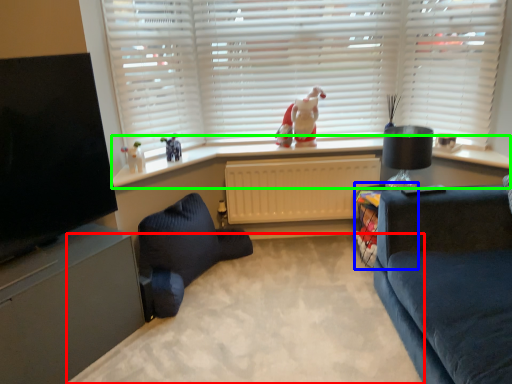
Question: Which is nearer to the plain (highlighted by a red box)? table (highlighted by a blue box) or window sill (highlighted by a green box).

Choices:
 (A) table
 (B) window sill

Answer: (A)